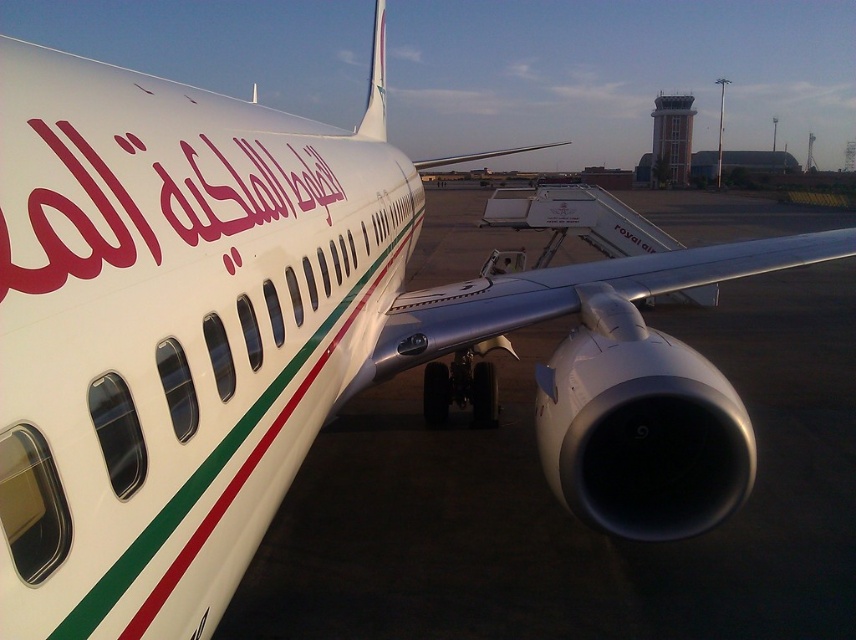
Question: Can you confirm if matte red text at center is positioned to the left of white glossy tail at upper center?

Choices:
 (A) yes
 (B) no

Answer: (B)

Question: Which object appears closest to the camera in this image?

Choices:
 (A) matte red text at center
 (B) white glossy tail at upper center

Answer: (A)

Question: Is matte red text at center below white glossy tail at upper center?

Choices:
 (A) yes
 (B) no

Answer: (A)

Question: Does matte red text at center have a greater width compared to white glossy tail at upper center?

Choices:
 (A) yes
 (B) no

Answer: (B)

Question: Which point appears closest to the camera in this image?

Choices:
 (A) (382, 42)
 (B) (117, 212)

Answer: (B)